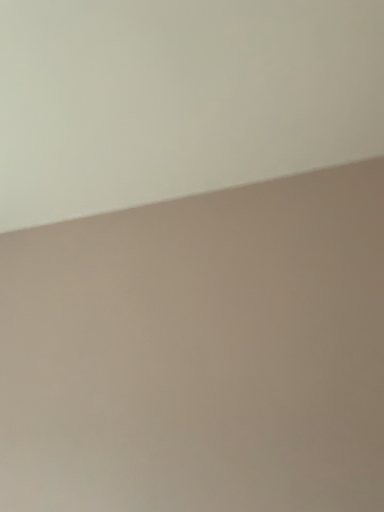
Measure the distance between point [323,42] and camera.

The distance of point [323,42] from camera is 87.60 centimeters.

Image resolution: width=384 pixels, height=512 pixels. What do you see at coordinates (179, 98) in the screenshot?
I see `matte white wall at upper left` at bounding box center [179, 98].

Identify the location of matte white wall at upper left. The height and width of the screenshot is (512, 384). tap(179, 98).

Find the location of a particular element. matte white wall at upper left is located at coordinates (179, 98).